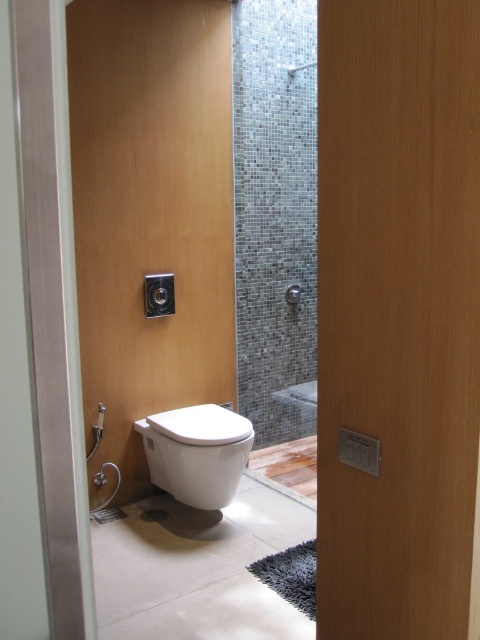
Question: Which of the following is the farthest from the observer?

Choices:
 (A) (144, 428)
 (B) (368, 260)
 (C) (84, 173)
 (D) (311, 65)

Answer: (D)

Question: Is wooden door at center bigger than white glossy toilet at lower left?

Choices:
 (A) yes
 (B) no

Answer: (A)

Question: Among these objects, which one is nearest to the camera?

Choices:
 (A) white glossy toilet at center
 (B) matte gray tile shower at upper center
 (C) white glossy toilet at lower left

Answer: (C)

Question: Is white glossy toilet at lower left thinner than matte gray tile shower at upper center?

Choices:
 (A) no
 (B) yes

Answer: (A)

Question: Which point appears closest to the camera in this image?

Choices:
 (A) (117, 131)
 (B) (315, 65)
 (C) (180, 436)

Answer: (C)

Question: Does white glossy toilet at lower left appear on the right side of matte gray tile shower at upper center?

Choices:
 (A) yes
 (B) no

Answer: (B)